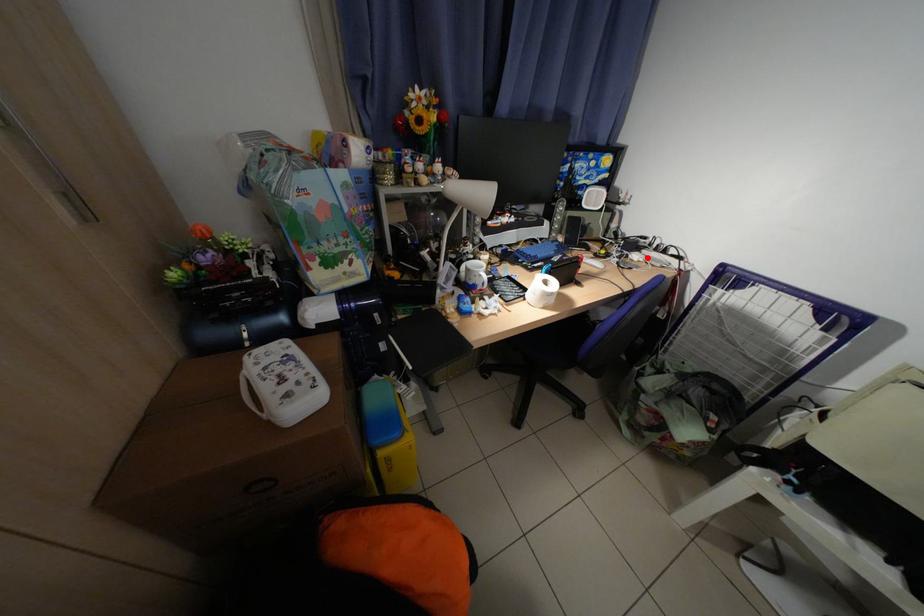
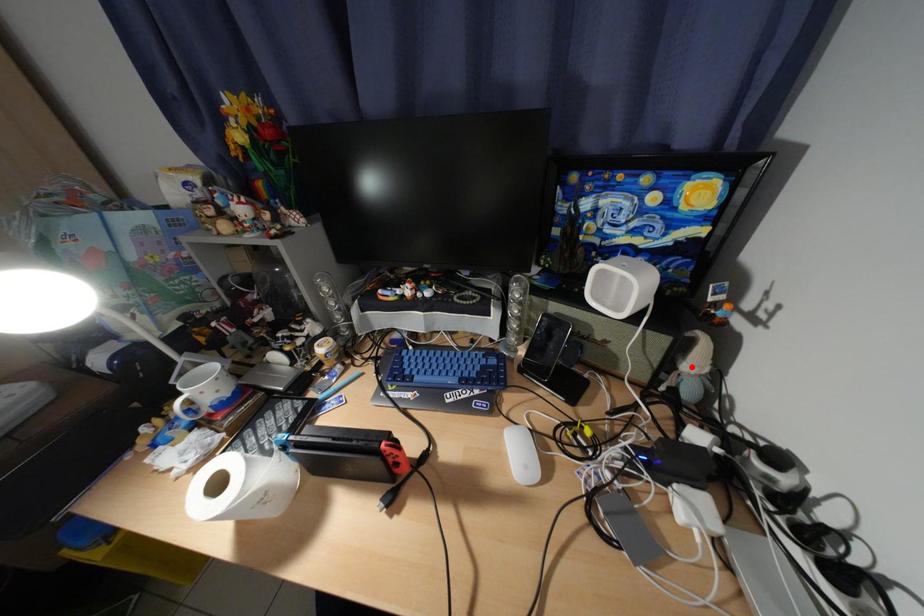
I am providing you with two images of the same scene from different viewpoints. A red point is marked on the first image and another point is marked on the second image. Is the marked point in image1 the same physical position as the marked point in image2?

No